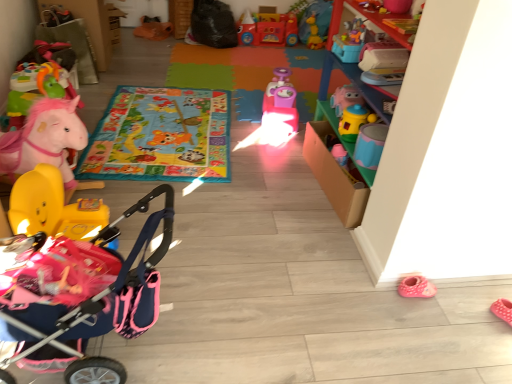
What are the coordinates of `vacant area situated below vibrant fabric playmat at center, arranged as the 1th mat when viewed from the front (from a real-world perspective)` in the screenshot? It's located at (164, 130).